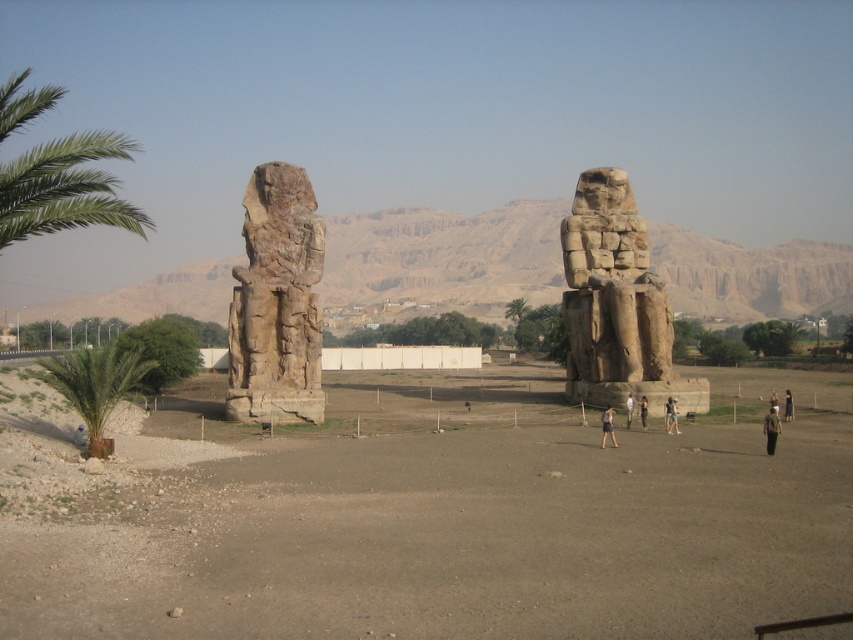
You are a tourist standing in front of the Colossi of Memnon. You notice two points marked in the image. The first point is at coordinate (630, 397) and the second is at (775, 406). Which point is closer to you?

Point (630, 397) is closer to you because it is further to the viewer than point (775, 406).

You are a visitor at the historical site and want to take a photo of the Colossi of Memnon. You notice two people wearing a light brown fabric dress at center and a light brown skin at center. Which of the two is shorter in height?

The light brown fabric dress at center is shorter than light brown skin at center, so the light brown fabric dress at center is shorter in height.